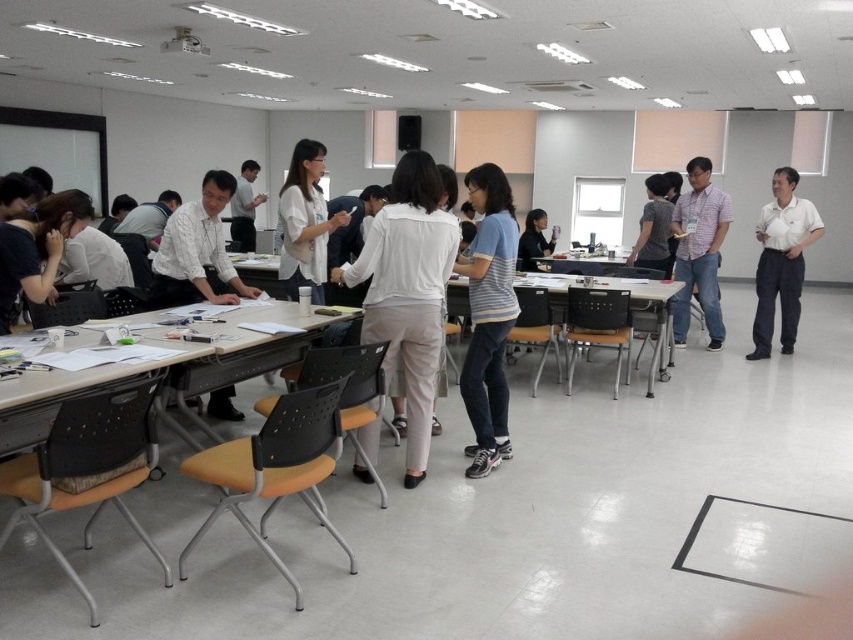
Between white smooth shirt at right and white shirt at center, which one is positioned higher?

white shirt at center is above.

Is white smooth shirt at right positioned behind white shirt at center?

No, white smooth shirt at right is in front of white shirt at center.

Does point (773, 202) lie in front of point (677, 198)?

That is False.

This screenshot has width=853, height=640. What are the coordinates of `white smooth shirt at right` in the screenshot? It's located at (781, 260).

Based on the photo, does white plastic table at lower left have a greater width compared to white smooth shirt at right?

Yes.

Does white plastic table at lower left come in front of white smooth shirt at right?

Yes, it is.

Does point (293, 348) come in front of point (787, 275)?

Yes, it is.

Find the location of a particular element. The image size is (853, 640). white plastic table at lower left is located at coordinates (166, 372).

Can you confirm if wooden table at center is wider than white plastic table at center?

Indeed, wooden table at center has a greater width compared to white plastic table at center.

Does wooden table at center appear under white plastic table at center?

Yes.

You are a GUI agent. You are given a task and a screenshot of the screen. Output one action in this format:
    pyautogui.click(x=<x>, y=<y>)
    Task: Click on the wooden table at center
    This screenshot has width=853, height=640.
    Given the screenshot: What is the action you would take?
    pyautogui.click(x=614, y=323)

At what (x,y) coordinates should I click in order to perform the action: click on wooden table at center. Please return your answer as a coordinate pair (x, y). Looking at the image, I should click on (614, 323).